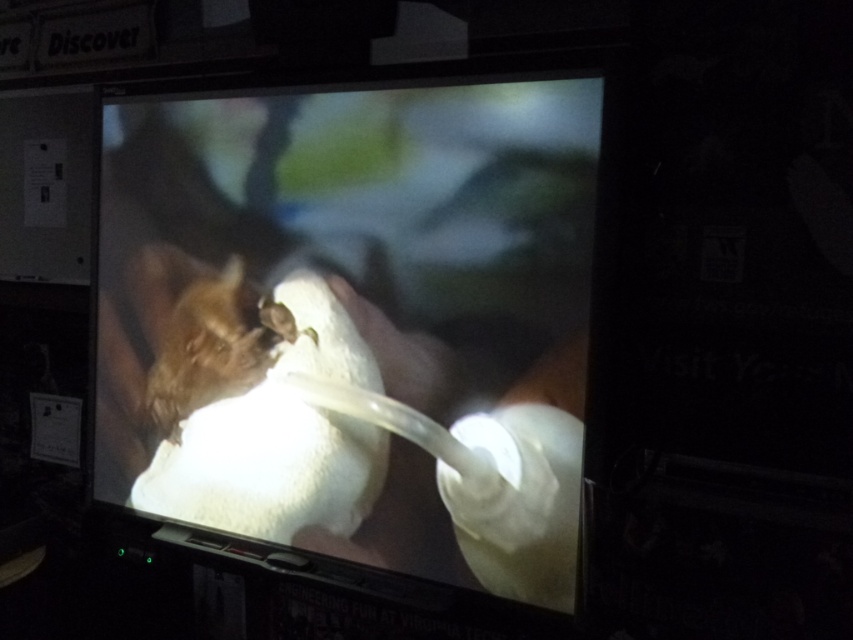
Question: Among these objects, which one is nearest to the camera?

Choices:
 (A) white plastic bottle at center
 (B) brown fur animal at center

Answer: (A)

Question: Is white plastic bottle at center smaller than brown fur animal at center?

Choices:
 (A) no
 (B) yes

Answer: (A)

Question: Can you confirm if white plastic bottle at center is positioned to the left of brown fur animal at center?

Choices:
 (A) yes
 (B) no

Answer: (B)

Question: Which point is farther from the camera taking this photo?

Choices:
 (A) (x=225, y=276)
 (B) (x=550, y=198)

Answer: (A)

Question: Is white plastic bottle at center smaller than brown fur animal at center?

Choices:
 (A) yes
 (B) no

Answer: (B)